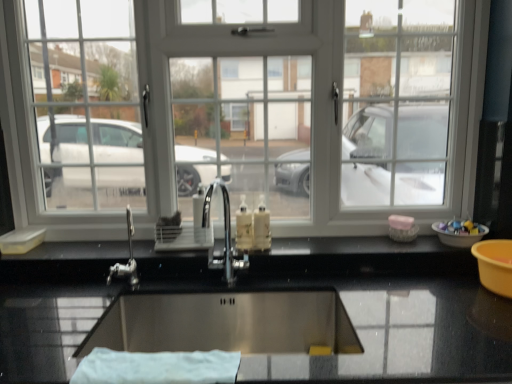
Locate an element on the screen. The image size is (512, 384). blank space situated above white cloth at lower center (from a real-world perspective) is located at coordinates (131, 362).